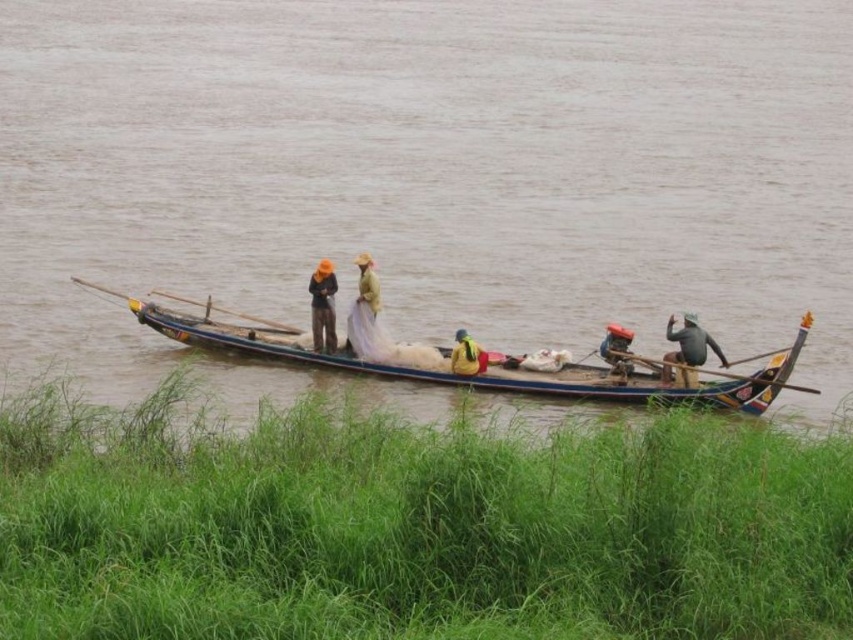
You are a drone operator trying to capture a photo of the brown wooden boat at center and the yellow fabric at center from above. The drone has a camera with a maximum zoom range of 30 meters. Can the drone capture both objects in a single photo without moving closer than 25 meters?

The distance between the brown wooden boat at center and the yellow fabric at center is 25.74 meters. Since the drone must stay at least 25 meters away, the total distance covered would be 25 meters plus the 25.74 meters between them, totaling 50.74 meters. The drone camera can only zoom up to 30 meters, so it cannot capture both objects in a single photo without moving closer.

You are standing on the shore of the lake and see the light brown woven hat at center on the boat. If you have a telescope with a 50 meter range, can you see the hat clearly through it?

The light brown woven hat at center is 40.69 meters away from the viewer. Since the telescope has a 50 meter range, it can clearly see the hat as it is within the telescope range.

From the picture: You are standing on the shore and looking at the boat. There are two points marked on the boat. Which point is closer to you, point (404, 317) or point (460, 369)?

Point (404, 317) is further to the camera than point (460, 369), so point (460, 369) is closer to you.